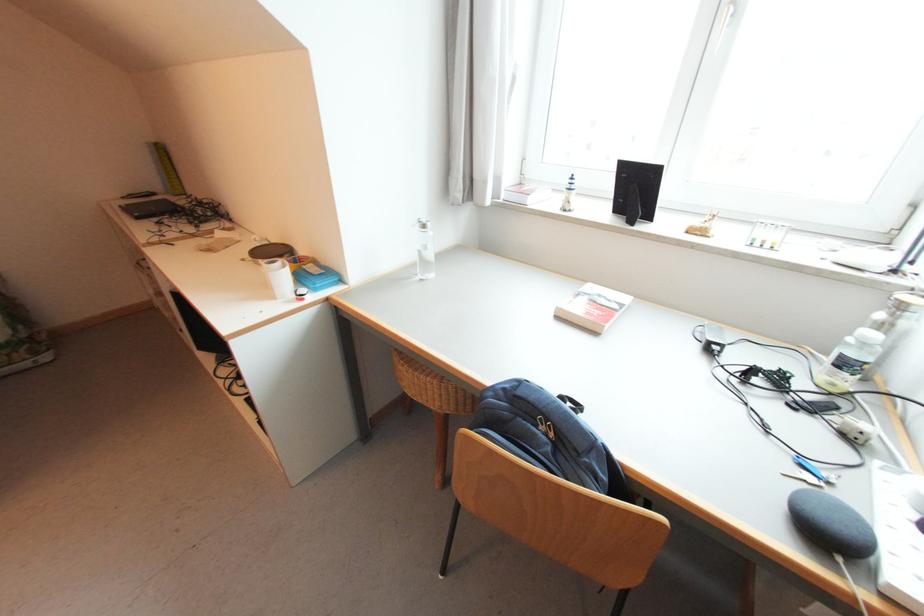
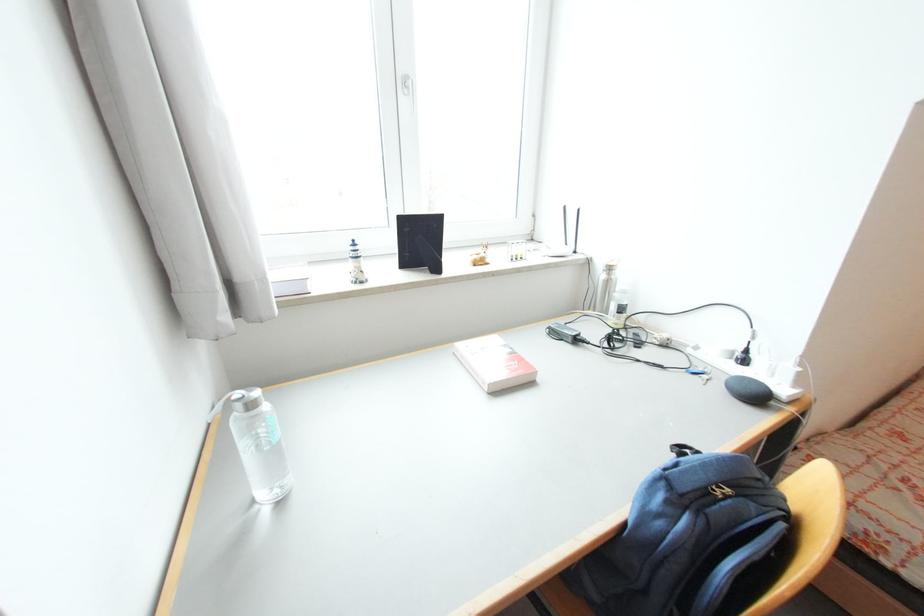
Find the pixel in the second image that matches (x=556, y=435) in the first image.

(734, 492)